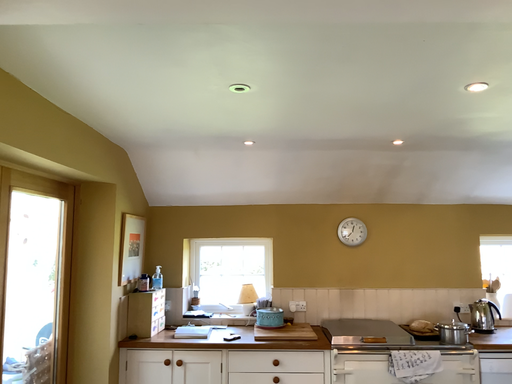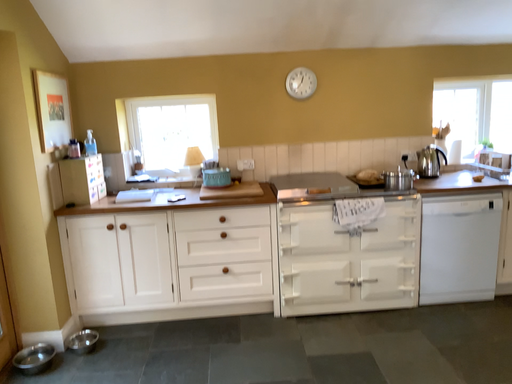
Question: How did the camera likely rotate when shooting the video?

Choices:
 (A) rotated upward
 (B) rotated downward

Answer: (B)